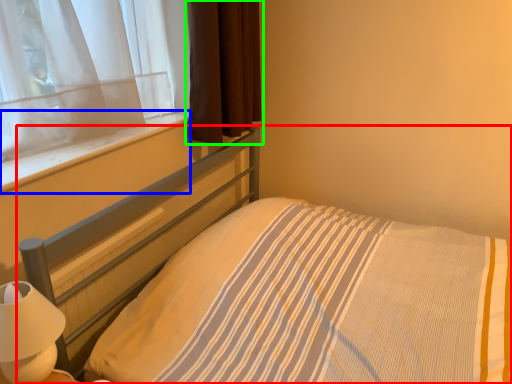
Question: Considering the real-world distances, which object is farthest from bed (highlighted by a red box)? window sill (highlighted by a blue box) or curtain (highlighted by a green box)?

Choices:
 (A) window sill
 (B) curtain

Answer: (B)